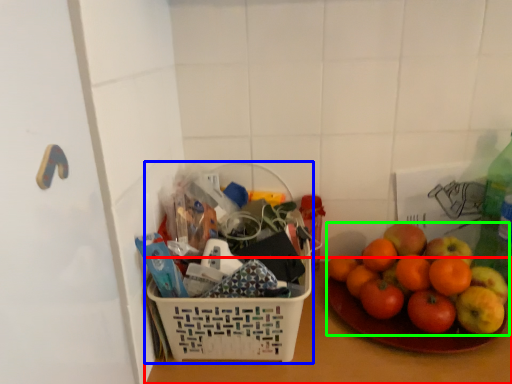
Question: Which object is positioned farthest from table top (highlighted by a red box)? Select from basket (highlighted by a blue box) and grapefruit (highlighted by a green box).

Choices:
 (A) basket
 (B) grapefruit

Answer: (A)